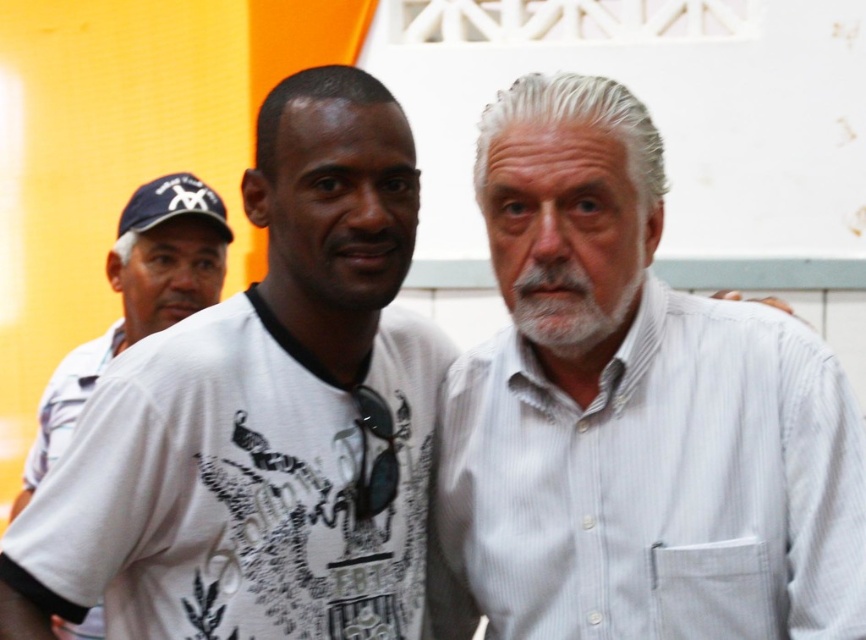
You are standing in front of a group photo. You want to know if you can comfortably take a step forward to get a better look at the white striped shirt at center without getting too close. The average comfortable personal space distance is 1 meter. Can you step forward?

The distance between you and the white striped shirt at center is 2.78 meters. Since the comfortable personal space is 1 meter, stepping forward to reduce the distance to 1 meter is possible. However, you need to move 1.78 meters closer. Whether it is comfortable depends on your preference, but the physical distance allows it.